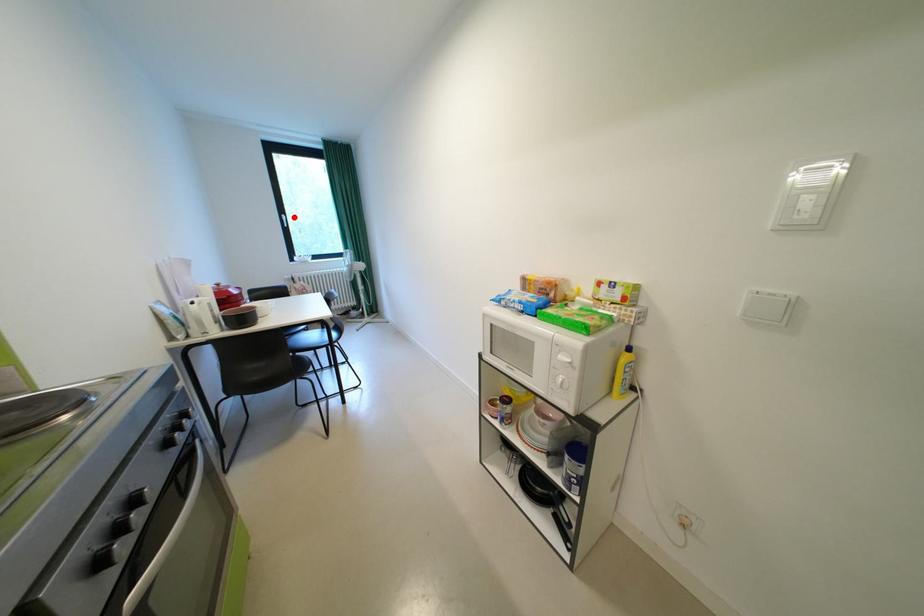
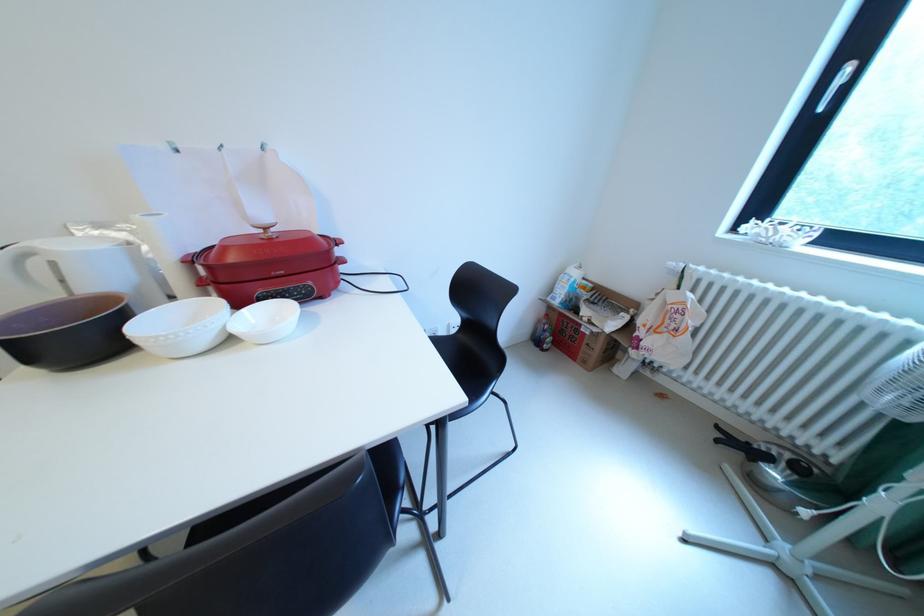
In the second image, find the point that corresponds to the highlighted location in the first image.

(859, 70)